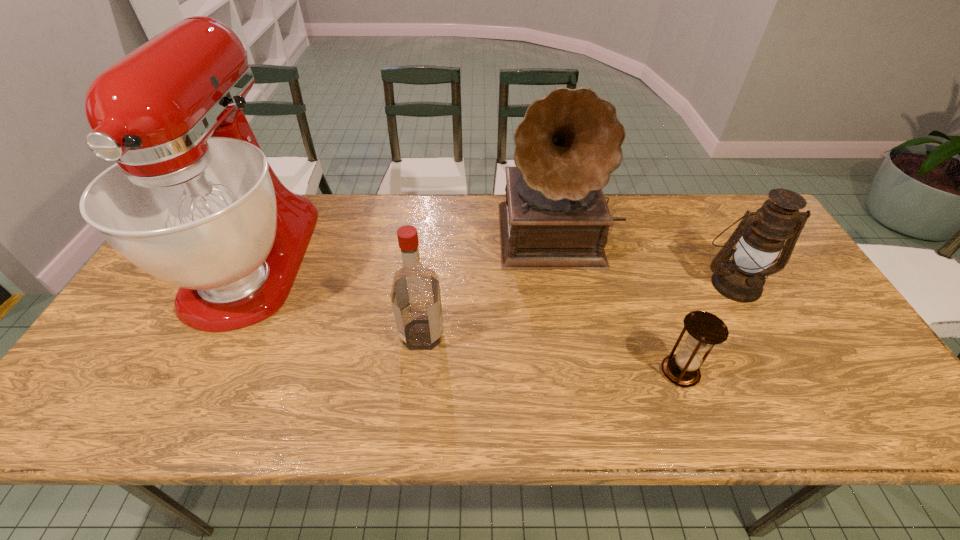
This screenshot has height=540, width=960. I want to click on vacant space located 0.080m on the back of the oil lamp, so click(x=714, y=246).

At what (x,y) coordinates should I click in order to perform the action: click on free space located on the back of the shortest object. Please return your answer as a coordinate pair (x, y). Looking at the image, I should click on (644, 273).

The height and width of the screenshot is (540, 960). Identify the location of mixer that is at the far edge. (192, 200).

Locate an element on the screen. record player present at the far edge is located at coordinates (555, 217).

Where is `object that is at the left edge`? object that is at the left edge is located at coordinates (192, 200).

Find the location of a particular element. object that is at the right edge is located at coordinates (761, 234).

Identify the location of object that is at the far left corner. This screenshot has width=960, height=540. (192, 200).

Image resolution: width=960 pixels, height=540 pixels. I want to click on vacant area at the far edge of the desktop, so (396, 218).

Identify the location of vacant space at the near edge. This screenshot has height=540, width=960. pos(199,406).

I want to click on vacant area at the left edge of the desktop, so click(x=144, y=333).